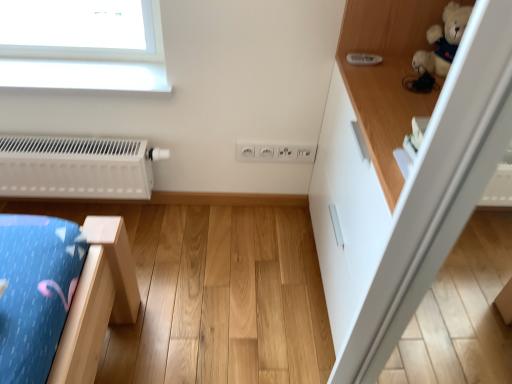
Question: Considering the relative sizes of white plastic electric outlet at center and white matte radiator at left in the image provided, is white plastic electric outlet at center bigger than white matte radiator at left?

Choices:
 (A) no
 (B) yes

Answer: (A)

Question: From the image's perspective, is white plastic electric outlet at center beneath white matte radiator at left?

Choices:
 (A) no
 (B) yes

Answer: (A)

Question: Could you tell me if white plastic electric outlet at center is turned towards white matte radiator at left?

Choices:
 (A) yes
 (B) no

Answer: (B)

Question: Does white plastic electric outlet at center have a lesser height compared to white matte radiator at left?

Choices:
 (A) no
 (B) yes

Answer: (B)

Question: Does white plastic electric outlet at center appear on the right side of white matte radiator at left?

Choices:
 (A) yes
 (B) no

Answer: (A)

Question: Looking at the image, does white matte radiator at left seem bigger or smaller compared to white plastic electric outlet at center?

Choices:
 (A) small
 (B) big

Answer: (B)

Question: From the image's perspective, is white matte radiator at left located above or below white plastic electric outlet at center?

Choices:
 (A) below
 (B) above

Answer: (A)

Question: Which is correct: white matte radiator at left is inside white plastic electric outlet at center, or outside of it?

Choices:
 (A) outside
 (B) inside

Answer: (A)

Question: In terms of width, does white matte radiator at left look wider or thinner when compared to white plastic electric outlet at center?

Choices:
 (A) thin
 (B) wide

Answer: (B)

Question: Do you think white glossy cabinet at upper right is within white matte radiator at left, or outside of it?

Choices:
 (A) outside
 (B) inside

Answer: (A)

Question: From a real-world perspective, is white glossy cabinet at upper right physically located above or below white matte radiator at left?

Choices:
 (A) above
 (B) below

Answer: (A)

Question: In terms of width, does white glossy cabinet at upper right look wider or thinner when compared to white matte radiator at left?

Choices:
 (A) wide
 (B) thin

Answer: (A)

Question: Looking at the image, does white glossy cabinet at upper right seem bigger or smaller compared to white matte radiator at left?

Choices:
 (A) small
 (B) big

Answer: (B)

Question: Is white plastic electric outlet at center inside or outside of white matte radiator at left?

Choices:
 (A) outside
 (B) inside

Answer: (A)

Question: Considering the positions of white plastic electric outlet at center and white matte radiator at left in the image, is white plastic electric outlet at center wider or thinner than white matte radiator at left?

Choices:
 (A) thin
 (B) wide

Answer: (A)